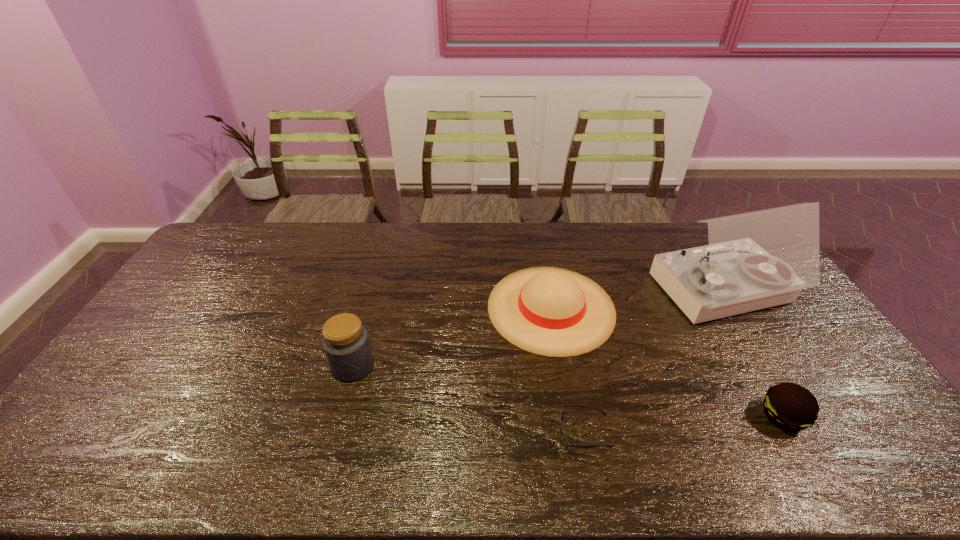
In the image, there is a desktop. What are the coordinates of `vacant area at the right edge` in the screenshot? It's located at click(768, 325).

Locate an element on the screen. This screenshot has width=960, height=540. free space at the near right corner of the desktop is located at coordinates (900, 457).

Where is `free point between the second shortest object and the sunglasses`? free point between the second shortest object and the sunglasses is located at coordinates (684, 424).

In order to click on free space between the sombrero and the shortest object in this screenshot , I will do click(567, 369).

Where is `vacant area that lies between the sombrero and the jar`? vacant area that lies between the sombrero and the jar is located at coordinates (452, 337).

Identify the location of vacant area that lies between the patty and the shortest object. 684,424.

At what (x,y) coordinates should I click in order to perform the action: click on blank region between the leftmost object and the sombrero. Please return your answer as a coordinate pair (x, y). Looking at the image, I should click on (452, 337).

Where is `vacant space that's between the sombrero and the leftmost object`? The height and width of the screenshot is (540, 960). vacant space that's between the sombrero and the leftmost object is located at coordinates (452, 337).

Identify the location of free point between the sunglasses and the jar. The width and height of the screenshot is (960, 540). (468, 399).

Identify the location of unoccupied position between the sombrero and the shortest object. The height and width of the screenshot is (540, 960). (567, 369).